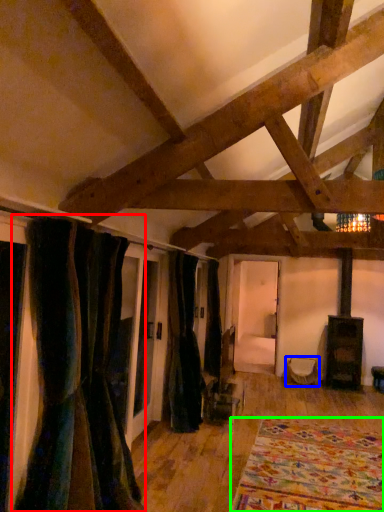
Question: Estimate the real-world distances between objects in this image. Which object is farther from curtain (highlighted by a red box), furniture (highlighted by a blue box) or blanket (highlighted by a green box)?

Choices:
 (A) furniture
 (B) blanket

Answer: (A)